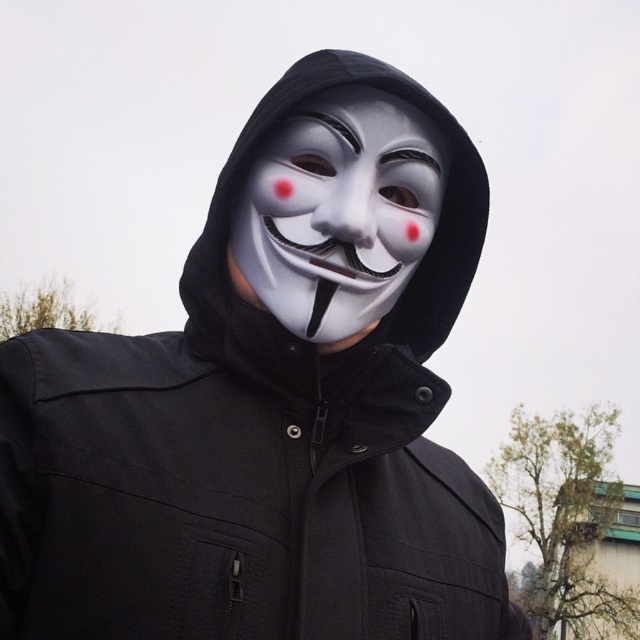
Question: Which point is farther from the camera taking this photo?

Choices:
 (A) (346, 193)
 (B) (344, 282)

Answer: (B)

Question: Can you confirm if white matte mask at center is positioned to the left of white matte/natural nose at center?

Choices:
 (A) yes
 (B) no

Answer: (B)

Question: In this image, where is white matte mask at center located relative to white matte/natural nose at center?

Choices:
 (A) above
 (B) below

Answer: (B)

Question: Which object appears farthest from the camera in this image?

Choices:
 (A) white matte mask at center
 (B) white matte/natural nose at center

Answer: (A)

Question: Which point is farther to the camera?

Choices:
 (A) white matte mask at center
 (B) white matte/natural nose at center

Answer: (A)

Question: Is white matte mask at center further to the viewer compared to white matte/natural nose at center?

Choices:
 (A) no
 (B) yes

Answer: (B)